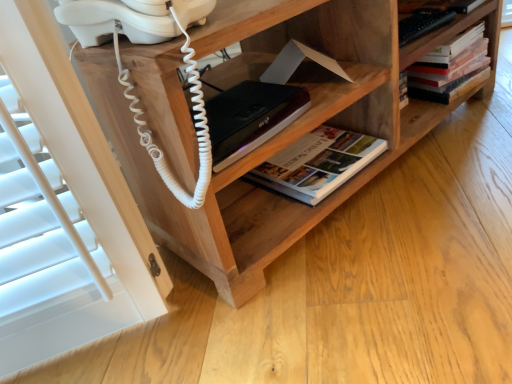
Describe the element at coordinates (318, 163) in the screenshot. This screenshot has width=512, height=384. I see `hardcover book at center, acting as the 2th book starting from the right` at that location.

This screenshot has width=512, height=384. What are the coordinates of `black matte book at center` in the screenshot? It's located at (250, 117).

Which is in front, point (429, 85) or point (306, 175)?

The point (306, 175) is closer.

Would you consider hardcover book at upper right, the 2th book in the left-to-right sequence, to be distant from hardcover book at center, the first book in the bottom-to-top sequence?

hardcover book at upper right, the 2th book in the left-to-right sequence, is actually quite close to hardcover book at center, the first book in the bottom-to-top sequence.

From the picture: Is hardcover book at upper right, which is counted as the first book, starting from the top, to the right of hardcover book at center, acting as the 2th book starting from the right, from the viewer's perspective?

Yes, hardcover book at upper right, which is counted as the first book, starting from the top, is to the right of hardcover book at center, acting as the 2th book starting from the right.

Which of these two, hardcover book at upper right, placed as the second book when sorted from bottom to top, or hardcover book at center, the first book positioned from the left, is wider?

Wider between the two is hardcover book at center, the first book positioned from the left.

In the scene shown: Does wooden shelf at center appear on the left side of hardcover book at center, the first book in the bottom-to-top sequence?

No.

From the image's perspective, between wooden shelf at center and hardcover book at center, the first book in the bottom-to-top sequence, which one is located above?

wooden shelf at center is shown above in the image.

Is wooden shelf at center not close to hardcover book at center, the 2th book when ordered from top to bottom?

No, wooden shelf at center is in close proximity to hardcover book at center, the 2th book when ordered from top to bottom.

Is black matte book at center not within hardcover book at upper right, placed as the second book when sorted from bottom to top?

Yes, black matte book at center is not within hardcover book at upper right, placed as the second book when sorted from bottom to top.

From a real-world perspective, is black matte book at center positioned above or below hardcover book at upper right, placed as the second book when sorted from bottom to top?

From a real-world perspective, black matte book at center is physically above hardcover book at upper right, placed as the second book when sorted from bottom to top.

Is the depth of black matte book at center less than that of hardcover book at upper right, which is counted as the first book, starting from the top?

Yes, black matte book at center is in front of hardcover book at upper right, which is counted as the first book, starting from the top.

Looking at their sizes, would you say black matte book at center is wider or thinner than hardcover book at upper right, which is counted as the first book, starting from the top?

black matte book at center is wider than hardcover book at upper right, which is counted as the first book, starting from the top.

What are the coordinates of `paperback book on the left of hardcover book at upper right, the first book from the right` in the screenshot? It's located at (250, 117).

How distant is hardcover book at upper right, the 2th book in the left-to-right sequence, from black matte book at center?

The distance of hardcover book at upper right, the 2th book in the left-to-right sequence, from black matte book at center is 20.91 inches.

Based on the photo, is black matte book at center a part of hardcover book at upper right, placed as the second book when sorted from bottom to top?

No, hardcover book at upper right, placed as the second book when sorted from bottom to top, does not contain black matte book at center.

Does hardcover book at upper right, the 2th book in the left-to-right sequence, have a smaller size compared to black matte book at center?

Actually, hardcover book at upper right, the 2th book in the left-to-right sequence, might be larger than black matte book at center.

Is black matte book at center far from hardcover book at center, the 2th book when ordered from top to bottom?

black matte book at center is near hardcover book at center, the 2th book when ordered from top to bottom, not far away.

From a real-world perspective, who is located higher, black matte book at center or hardcover book at center, the first book in the bottom-to-top sequence?

In real-world perspective, black matte book at center is above.

Considering the sizes of objects black matte book at center and hardcover book at center, the first book in the bottom-to-top sequence, in the image provided, who is taller, black matte book at center or hardcover book at center, the first book in the bottom-to-top sequence,?

With more height is black matte book at center.

Measure the distance between black matte book at center and hardcover book at center, the 2th book when ordered from top to bottom.

The distance of black matte book at center from hardcover book at center, the 2th book when ordered from top to bottom, is 19.33 centimeters.

From the image's perspective, is wooden shelf at center positioned above or below hardcover book at upper right, placed as the second book when sorted from bottom to top?

wooden shelf at center is below hardcover book at upper right, placed as the second book when sorted from bottom to top.

Can you confirm if wooden shelf at center is shorter than hardcover book at upper right, placed as the second book when sorted from bottom to top?

No.

In terms of size, does wooden shelf at center appear bigger or smaller than hardcover book at upper right, the 2th book in the left-to-right sequence?

wooden shelf at center is bigger than hardcover book at upper right, the 2th book in the left-to-right sequence.

Considering the sizes of objects wooden shelf at center and hardcover book at upper right, which is counted as the first book, starting from the top, in the image provided, who is wider, wooden shelf at center or hardcover book at upper right, which is counted as the first book, starting from the top,?

wooden shelf at center.

Can you confirm if hardcover book at center, the 2th book when ordered from top to bottom, is taller than wooden shelf at center?

No, hardcover book at center, the 2th book when ordered from top to bottom, is not taller than wooden shelf at center.

Which object is thinner, hardcover book at center, acting as the 2th book starting from the right, or wooden shelf at center?

With smaller width is hardcover book at center, acting as the 2th book starting from the right.

From the image's perspective, is hardcover book at center, the 2th book when ordered from top to bottom, on wooden shelf at center?

No, from the image's perspective, hardcover book at center, the 2th book when ordered from top to bottom, is not over wooden shelf at center.

Is hardcover book at center, the first book in the bottom-to-top sequence, further to the viewer compared to wooden shelf at center?

Yes.

Where is `book above the hardcover book at center, the first book positioned from the left (from the image's perspective)`? The width and height of the screenshot is (512, 384). book above the hardcover book at center, the first book positioned from the left (from the image's perspective) is located at coordinates coord(450,67).

Where is `shelf on the right of hardcover book at center, acting as the 2th book starting from the right`? shelf on the right of hardcover book at center, acting as the 2th book starting from the right is located at coordinates (273, 138).

From the picture: When comparing their distances from black matte book at center, does wooden shelf at center or hardcover book at upper right, the 2th book in the left-to-right sequence, seem closer?

wooden shelf at center is closer to black matte book at center.

From the image, which object appears to be farther from hardcover book at upper right, placed as the second book when sorted from bottom to top, hardcover book at center, the 2th book when ordered from top to bottom, or wooden shelf at center?

Based on the image, wooden shelf at center appears to be further to hardcover book at upper right, placed as the second book when sorted from bottom to top.

Which object lies further to the anchor point wooden shelf at center, hardcover book at center, the first book positioned from the left, or hardcover book at upper right, the first book from the right?

hardcover book at upper right, the first book from the right.

In the scene shown: From the image, which object appears to be farther from wooden shelf at center, black matte book at center or hardcover book at upper right, the first book from the right?

Based on the image, hardcover book at upper right, the first book from the right, appears to be further to wooden shelf at center.

Considering their positions, is hardcover book at upper right, the 2th book in the left-to-right sequence, positioned further to hardcover book at center, the first book positioned from the left, than black matte book at center?

hardcover book at upper right, the 2th book in the left-to-right sequence, is further to hardcover book at center, the first book positioned from the left.

Looking at this image, from the image, which object appears to be farther from hardcover book at upper right, the 2th book in the left-to-right sequence, wooden shelf at center or hardcover book at center, the 2th book when ordered from top to bottom?

wooden shelf at center is positioned further to the anchor hardcover book at upper right, the 2th book in the left-to-right sequence.

From the image, which object appears to be nearer to hardcover book at upper right, placed as the second book when sorted from bottom to top, black matte book at center or wooden shelf at center?

The object closer to hardcover book at upper right, placed as the second book when sorted from bottom to top, is wooden shelf at center.

Considering their positions, is wooden shelf at center positioned further to hardcover book at center, the first book positioned from the left, than hardcover book at upper right, which is counted as the first book, starting from the top?

hardcover book at upper right, which is counted as the first book, starting from the top.

At what (x,y) coordinates should I click in order to perform the action: click on paperback book between wooden shelf at center and hardcover book at center, the first book in the bottom-to-top sequence, along the z-axis. Please return your answer as a coordinate pair (x, y). Looking at the image, I should click on 250,117.

Where is `book between black matte book at center and hardcover book at upper right, placed as the second book when sorted from bottom to top, from left to right`? The height and width of the screenshot is (384, 512). book between black matte book at center and hardcover book at upper right, placed as the second book when sorted from bottom to top, from left to right is located at coordinates coord(318,163).

Locate an element on the screen. The image size is (512, 384). shelf between black matte book at center and hardcover book at upper right, the first book from the right, in the horizontal direction is located at coordinates (273, 138).

This screenshot has height=384, width=512. I want to click on book between wooden shelf at center and hardcover book at upper right, placed as the second book when sorted from bottom to top, from front to back, so click(318, 163).